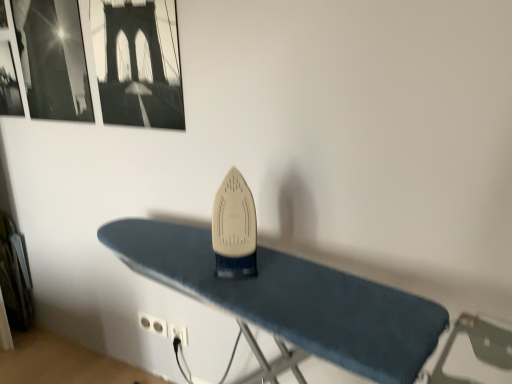
Question: In the image, is black plastic plug at lower center, which is counted as the 2th plug, starting from the left, positioned in front of or behind black paper picture frame at upper left, arranged as the 2th picture frame when viewed from the left?

Choices:
 (A) front
 (B) behind

Answer: (B)

Question: In terms of height, does black plastic plug at lower center, which is the first plug in right-to-left order, look taller or shorter compared to black paper picture frame at upper left, arranged as the 2th picture frame when viewed from the left?

Choices:
 (A) tall
 (B) short

Answer: (B)

Question: Which object is positioned closest to the black plastic plug at lower center, which is the first plug in right-to-left order?

Choices:
 (A) white plastic plug at lower center, marked as the 1th plug in a left-to-right arrangement
 (B) blue fabric ironing board at center
 (C) black paper picture frame at upper left, positioned as the 1th picture frame in right-to-left order
 (D) black glossy picture frame at upper left, arranged as the 2th picture frame when viewed from the right
 (E) white plastic iron at center

Answer: (A)

Question: Estimate the real-world distances between objects in this image. Which object is farther from the blue fabric ironing board at center?

Choices:
 (A) black glossy picture frame at upper left, arranged as the 2th picture frame when viewed from the right
 (B) white plastic iron at center
 (C) black paper picture frame at upper left, positioned as the 1th picture frame in right-to-left order
 (D) white plastic plug at lower center, the 2th plug viewed from the right
 (E) black plastic plug at lower center, which is counted as the 2th plug, starting from the left

Answer: (D)